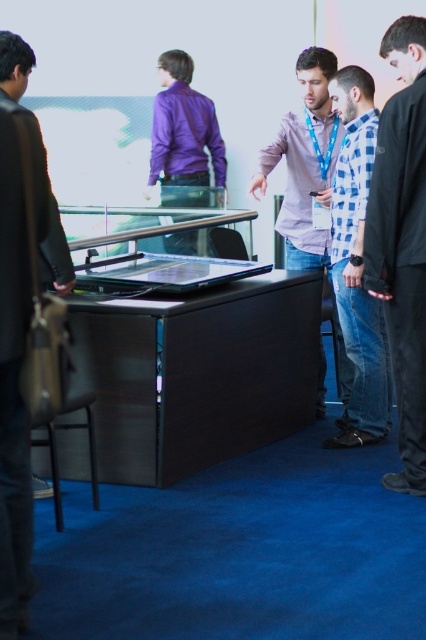
Which of these two, black cotton shirt at right or dark brown leather jacket at left, stands taller?

black cotton shirt at right is taller.

Is black cotton shirt at right to the left of dark brown leather jacket at left from the viewer's perspective?

No, black cotton shirt at right is not to the left of dark brown leather jacket at left.

You are a GUI agent. You are given a task and a screenshot of the screen. Output one action in this format:
    pyautogui.click(x=<x>, y=<y>)
    Task: Click on the black cotton shirt at right
    Image resolution: width=426 pixels, height=640 pixels.
    Given the screenshot: What is the action you would take?
    pyautogui.click(x=402, y=241)

Does black cotton shirt at right appear over matte pink shirt at center?

No, black cotton shirt at right is not above matte pink shirt at center.

Measure the distance from black cotton shirt at right to matte pink shirt at center.

1.04 meters

Between point (391, 125) and point (293, 252), which one is positioned behind?

Point (293, 252)

Identify the location of black cotton shirt at right. (402, 241).

Looking at this image, can you confirm if matte pink shirt at center is positioned to the left of purple smooth shirt at upper left?

Incorrect, matte pink shirt at center is not on the left side of purple smooth shirt at upper left.

How distant is matte pink shirt at center from purple smooth shirt at upper left?

7.23 feet

Locate an element on the screen. matte pink shirt at center is located at coordinates (305, 161).

Find the location of a particular element. This screenshot has width=426, height=640. matte pink shirt at center is located at coordinates (305, 161).